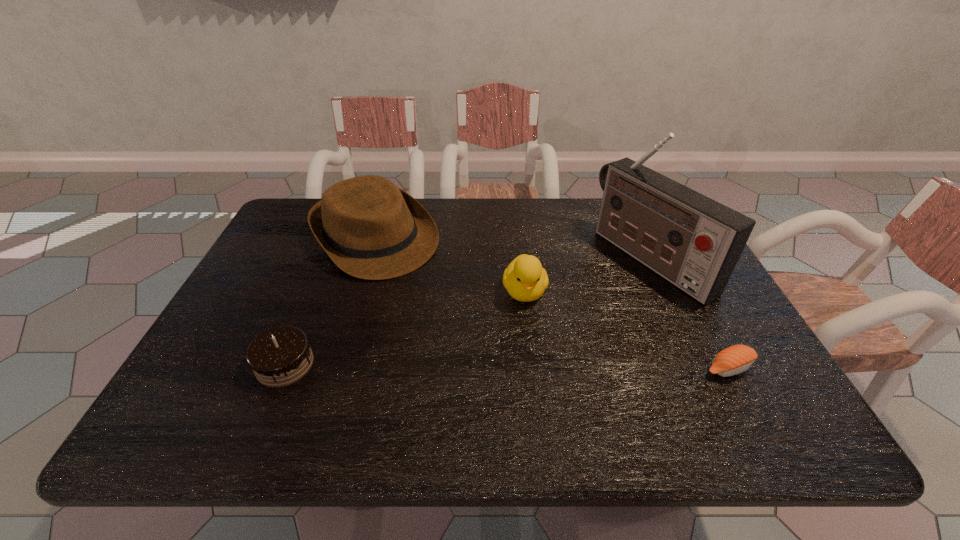
Find the location of a particular element. The image size is (960, 540). vacant space that satisfies the following two spatial constraints: 1. on the back side of the fourth tallest object; 2. on the right side of the duck is located at coordinates (315, 292).